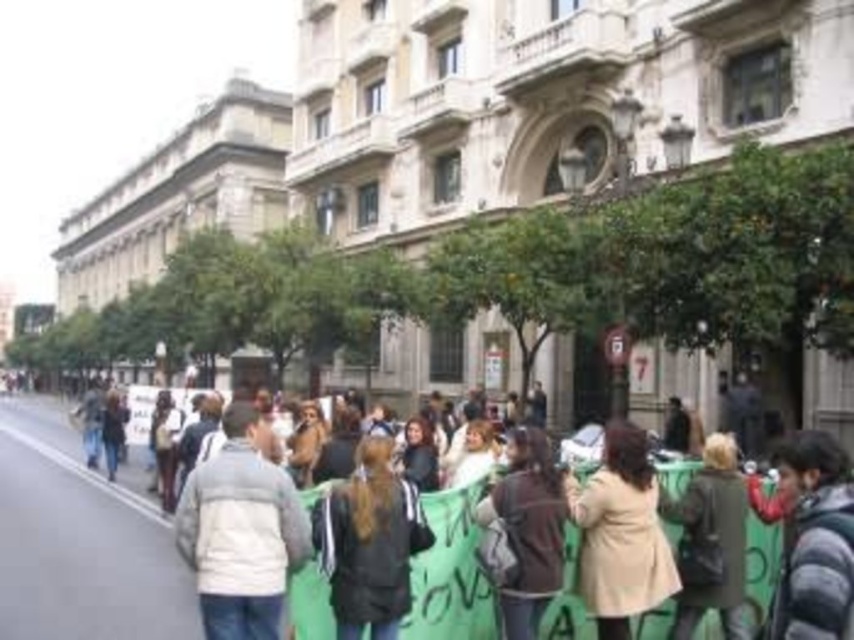
Who is positioned more to the right, light gray fleece jacket at center or dark gray jacket at center?

From the viewer's perspective, dark gray jacket at center appears more on the right side.

Is light gray fleece jacket at center to the right of dark gray jacket at center from the viewer's perspective?

Incorrect, light gray fleece jacket at center is not on the right side of dark gray jacket at center.

Which is in front, point (255, 509) or point (351, 628)?

Point (351, 628) is in front.

This screenshot has height=640, width=854. In order to click on light gray fleece jacket at center in this screenshot , I will do `click(241, 532)`.

Which is above, gray asphalt at lower left or dark gray jacket at center?

dark gray jacket at center is above.

Between point (139, 595) and point (351, 611), which one is positioned behind?

Point (139, 595)

You are a GUI agent. You are given a task and a screenshot of the screen. Output one action in this format:
    pyautogui.click(x=<x>, y=<y>)
    Task: Click on the gray asphalt at lower left
    
    Given the screenshot: What is the action you would take?
    pyautogui.click(x=79, y=541)

The height and width of the screenshot is (640, 854). Describe the element at coordinates (79, 541) in the screenshot. I see `gray asphalt at lower left` at that location.

The height and width of the screenshot is (640, 854). In order to click on gray asphalt at lower left in this screenshot , I will do `click(79, 541)`.